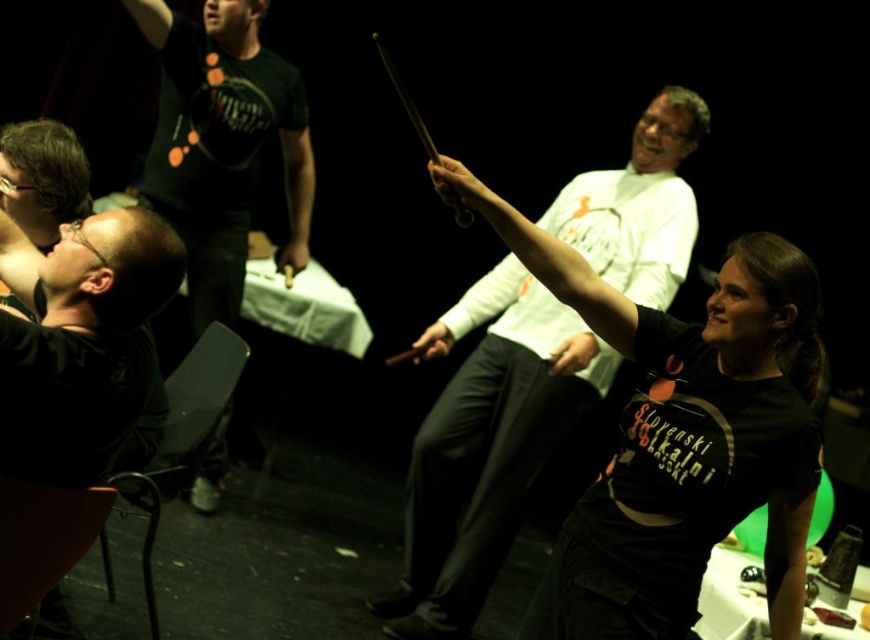
Can you confirm if matte black shirt at center is positioned above matte black shirt at upper left?

Incorrect, matte black shirt at center is not positioned above matte black shirt at upper left.

The height and width of the screenshot is (640, 870). Describe the element at coordinates (487, 444) in the screenshot. I see `matte black shirt at center` at that location.

The height and width of the screenshot is (640, 870). In order to click on matte black shirt at center in this screenshot , I will do `click(487, 444)`.

Is matte black shirt at left behind matte black shirt at upper left?

No, it is in front of matte black shirt at upper left.

Does matte black shirt at left lie in front of matte black shirt at upper left?

Yes, it is in front of matte black shirt at upper left.

Image resolution: width=870 pixels, height=640 pixels. Find the location of `matte black shirt at left`. matte black shirt at left is located at coordinates (79, 340).

Locate an element on the screen. Image resolution: width=870 pixels, height=640 pixels. matte black shirt at left is located at coordinates (79, 340).

Does black matte t-shirt at upper center appear under matte black shirt at left?

No, black matte t-shirt at upper center is not below matte black shirt at left.

Is point (293, 189) more distant than point (101, 284)?

Yes, it is behind point (101, 284).

Image resolution: width=870 pixels, height=640 pixels. Find the location of `black matte t-shirt at upper center`. black matte t-shirt at upper center is located at coordinates (222, 145).